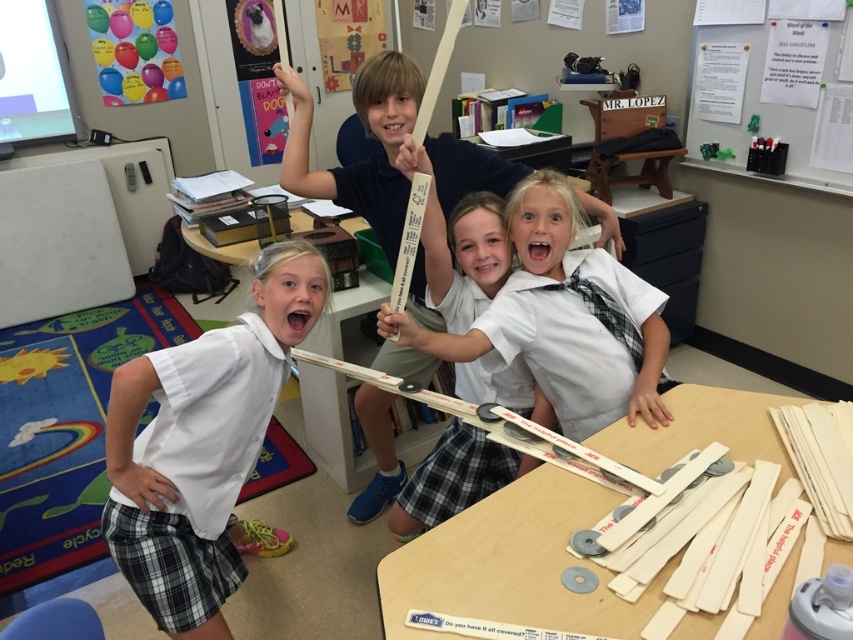
You are a photographer trying to capture a clear shot of the white glossy shirt at center and the white glossy tie at center. Since both are white, you need to adjust your camera settings to ensure the tie is visible. Based on their positions, which object should you focus on to make sure the tie is in focus?

The white glossy shirt at center is in front of the white glossy tie at center, so focusing on the shirt will ensure the tie is also in focus as it is behind it.

Based on the photo, you are a photographer in the classroom and want to capture a photo of the white glossy shirt at center and the white cardboard strips at center. Which object should you focus on first if you want to ensure both are in sharp focus?

The white glossy shirt at center is located above the white cardboard strips at center, so you should focus on the white glossy shirt at center first to ensure both are in sharp focus.

You are a photographer standing in the classroom and want to take a photo that includes both the point at (131, 440) and the point at (521, 589). Which point should you focus on to ensure both are in sharp focus?

You should focus on the point that is closer to the camera, which is point (521, 589), because the depth of field will naturally include the further point (131, 440) as well.